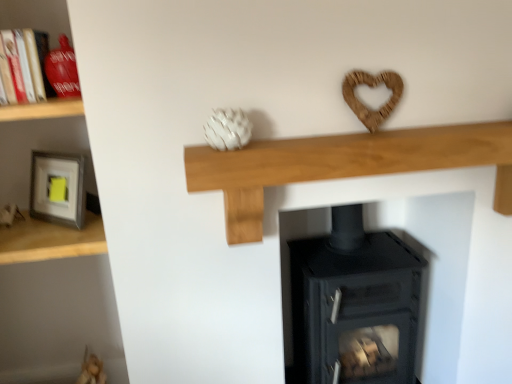
The height and width of the screenshot is (384, 512). What do you see at coordinates (27, 63) in the screenshot?
I see `matte red vase at upper left` at bounding box center [27, 63].

In order to face matte gray frame at left, arranged as the fourth shelf when viewed from the right, should I rotate leftwards or rightwards?

Rotate your view left by about 28.600°.

How much space does matte gray frame at left, arranged as the fourth shelf when viewed from the right, occupy horizontally?

46.19 centimeters.

The image size is (512, 384). Describe the element at coordinates (342, 165) in the screenshot. I see `natural wood mantle at center, which ranks as the first shelf in right-to-left order` at that location.

Find the location of a particular element. The width and height of the screenshot is (512, 384). wooden shelf at left, acting as the 3th shelf starting from the left is located at coordinates (42, 109).

Based on the photo, can you see matte gray frame at left, arranged as the third shelf when viewed from the right, touching wooden shelf at left, which appears as the 2th shelf when viewed from the right?

There is a gap between matte gray frame at left, arranged as the third shelf when viewed from the right, and wooden shelf at left, which appears as the 2th shelf when viewed from the right.

From the image's perspective, between matte gray frame at left, which ranks as the second shelf in left-to-right order, and wooden shelf at left, which appears as the 2th shelf when viewed from the right, which one is located above?

wooden shelf at left, which appears as the 2th shelf when viewed from the right, appears higher in the image.

Considering the sizes of objects matte gray frame at left, which ranks as the second shelf in left-to-right order, and wooden shelf at left, acting as the 3th shelf starting from the left, in the image provided, who is shorter, matte gray frame at left, which ranks as the second shelf in left-to-right order, or wooden shelf at left, acting as the 3th shelf starting from the left,?

wooden shelf at left, acting as the 3th shelf starting from the left, is shorter.

In the scene shown: Considering the sizes of matte gray frame at left, which ranks as the second shelf in left-to-right order, and wooden shelf at left, which appears as the 2th shelf when viewed from the right, in the image, is matte gray frame at left, which ranks as the second shelf in left-to-right order, wider or thinner than wooden shelf at left, which appears as the 2th shelf when viewed from the right,?

Considering their sizes, matte gray frame at left, which ranks as the second shelf in left-to-right order, looks slimmer than wooden shelf at left, which appears as the 2th shelf when viewed from the right.

Considering the relative sizes of matte red vase at upper left and natural wood mantle at center, placed as the 4th shelf when sorted from left to right, in the image provided, is matte red vase at upper left thinner than natural wood mantle at center, placed as the 4th shelf when sorted from left to right,?

No.

Is natural wood mantle at center, placed as the 4th shelf when sorted from left to right, surrounded by matte red vase at upper left?

Definitely not — natural wood mantle at center, placed as the 4th shelf when sorted from left to right, is not inside matte red vase at upper left.

From a real-world perspective, between matte red vase at upper left and natural wood mantle at center, placed as the 4th shelf when sorted from left to right, who is vertically lower?

From a 3D spatial view, natural wood mantle at center, placed as the 4th shelf when sorted from left to right, is below.

Who is taller, matte red vase at upper left or natural wood mantle at center, placed as the 4th shelf when sorted from left to right?

With more height is natural wood mantle at center, placed as the 4th shelf when sorted from left to right.

Is matte gray frame at left, arranged as the fourth shelf when viewed from the right, turned away from matte gray frame at left, which ranks as the second shelf in left-to-right order?

matte gray frame at left, arranged as the fourth shelf when viewed from the right, is not turned away from matte gray frame at left, which ranks as the second shelf in left-to-right order.

Is matte gray frame at left, which appears as the first shelf when viewed from the left, taller or shorter than matte gray frame at left, arranged as the third shelf when viewed from the right?

Clearly, matte gray frame at left, which appears as the first shelf when viewed from the left, is taller compared to matte gray frame at left, arranged as the third shelf when viewed from the right.

Between point (8, 230) and point (44, 246), which one is positioned behind?

Point (8, 230)

Which object is further away from the camera taking this photo, matte gray frame at left, which appears as the first shelf when viewed from the left, or matte gray frame at left, which ranks as the second shelf in left-to-right order?

matte gray frame at left, which ranks as the second shelf in left-to-right order.

From a real-world perspective, which object rests below the other?

From a 3D spatial view, black matte wood burning stove at center is below.

Based on the photo, from the image's perspective, is wooden shelf at left, acting as the 3th shelf starting from the left, over black matte wood burning stove at center?

Yes.

How different are the orientations of wooden shelf at left, which appears as the 2th shelf when viewed from the right, and black matte wood burning stove at center in degrees?

The angle between the facing direction of wooden shelf at left, which appears as the 2th shelf when viewed from the right, and the facing direction of black matte wood burning stove at center is 0.975 degrees.

Is point (53, 112) positioned behind point (318, 379)?

No.

Is natural wood mantle at center, which ranks as the first shelf in right-to-left order, next to matte red vase at upper left and touching it?

They are not placed beside each other.

Which object is further away from the camera taking this photo, natural wood mantle at center, placed as the 4th shelf when sorted from left to right, or matte red vase at upper left?

matte red vase at upper left is further away from the camera.

Locate an element on the screen. The width and height of the screenshot is (512, 384). shelf that is the 2nd object located in front of the matte red vase at upper left is located at coordinates (342, 165).

What's the angular difference between natural wood mantle at center, placed as the 4th shelf when sorted from left to right, and matte red vase at upper left's facing directions?

The angular difference between natural wood mantle at center, placed as the 4th shelf when sorted from left to right, and matte red vase at upper left is 6.83e-05 degrees.

Does black matte wood burning stove at center have a lesser height compared to wooden shelf at left, acting as the 3th shelf starting from the left?

Incorrect, the height of black matte wood burning stove at center does not fall short of that of wooden shelf at left, acting as the 3th shelf starting from the left.

Relative to wooden shelf at left, which appears as the 2th shelf when viewed from the right, is black matte wood burning stove at center in front or behind?

Clearly, black matte wood burning stove at center is behind wooden shelf at left, which appears as the 2th shelf when viewed from the right.

Is black matte wood burning stove at center far from wooden shelf at left, which appears as the 2th shelf when viewed from the right?

Absolutely, black matte wood burning stove at center is distant from wooden shelf at left, which appears as the 2th shelf when viewed from the right.

From the image's perspective, relative to wooden shelf at left, acting as the 3th shelf starting from the left, is black matte wood burning stove at center above or below?

From the image's perspective, black matte wood burning stove at center appears below wooden shelf at left, acting as the 3th shelf starting from the left.

Between natural wood mantle at center, placed as the 4th shelf when sorted from left to right, and matte gray frame at left, arranged as the fourth shelf when viewed from the right, which one has larger width?

matte gray frame at left, arranged as the fourth shelf when viewed from the right, is wider.

Does natural wood mantle at center, which ranks as the first shelf in right-to-left order, appear on the right side of matte gray frame at left, which appears as the first shelf when viewed from the left?

Indeed, natural wood mantle at center, which ranks as the first shelf in right-to-left order, is positioned on the right side of matte gray frame at left, which appears as the first shelf when viewed from the left.

Considering the sizes of objects natural wood mantle at center, placed as the 4th shelf when sorted from left to right, and matte gray frame at left, arranged as the fourth shelf when viewed from the right, in the image provided, who is bigger, natural wood mantle at center, placed as the 4th shelf when sorted from left to right, or matte gray frame at left, arranged as the fourth shelf when viewed from the right,?

Bigger between the two is matte gray frame at left, arranged as the fourth shelf when viewed from the right.

From the wooden shelf at left, acting as the 3th shelf starting from the left, count the 1st shelf to the left and point to it. Please provide its 2D coordinates.

[(50, 240)]

Image resolution: width=512 pixels, height=384 pixels. I want to click on the 2nd shelf in front of the matte red vase at upper left, so click(342, 165).

Looking at the image, which one is located further to black matte wood burning stove at center, matte gray frame at left, arranged as the fourth shelf when viewed from the right, or matte gray frame at left, arranged as the third shelf when viewed from the right?

matte gray frame at left, arranged as the fourth shelf when viewed from the right, is further to black matte wood burning stove at center.

When comparing their distances from wooden shelf at left, acting as the 3th shelf starting from the left, does matte gray frame at left, which ranks as the second shelf in left-to-right order, or black matte wood burning stove at center seem further?

black matte wood burning stove at center is further to wooden shelf at left, acting as the 3th shelf starting from the left.

Estimate the real-world distances between objects in this image. Which object is closer to matte gray frame at left, which appears as the first shelf when viewed from the left, natural wood mantle at center, placed as the 4th shelf when sorted from left to right, or matte gray frame at left, arranged as the third shelf when viewed from the right?

matte gray frame at left, arranged as the third shelf when viewed from the right, is positioned closer to the anchor matte gray frame at left, which appears as the first shelf when viewed from the left.

Which object lies nearer to the anchor point matte gray frame at left, which appears as the first shelf when viewed from the left, natural wood mantle at center, which ranks as the first shelf in right-to-left order, or wooden shelf at left, which appears as the 2th shelf when viewed from the right?

Based on the image, wooden shelf at left, which appears as the 2th shelf when viewed from the right, appears to be nearer to matte gray frame at left, which appears as the first shelf when viewed from the left.

When comparing their distances from natural wood mantle at center, which ranks as the first shelf in right-to-left order, does wooden shelf at left, which appears as the 2th shelf when viewed from the right, or matte red vase at upper left seem closer?

The object closer to natural wood mantle at center, which ranks as the first shelf in right-to-left order, is wooden shelf at left, which appears as the 2th shelf when viewed from the right.

Which object lies further to the anchor point matte gray frame at left, arranged as the third shelf when viewed from the right, matte red vase at upper left or black matte wood burning stove at center?

Among the two, black matte wood burning stove at center is located further to matte gray frame at left, arranged as the third shelf when viewed from the right.

From the image, which object appears to be nearer to black matte wood burning stove at center, wooden shelf at left, acting as the 3th shelf starting from the left, or matte gray frame at left, which ranks as the second shelf in left-to-right order?

The object closer to black matte wood burning stove at center is matte gray frame at left, which ranks as the second shelf in left-to-right order.

From the image, which object appears to be farther from matte gray frame at left, arranged as the fourth shelf when viewed from the right, matte gray frame at left, arranged as the third shelf when viewed from the right, or natural wood mantle at center, placed as the 4th shelf when sorted from left to right?

natural wood mantle at center, placed as the 4th shelf when sorted from left to right, lies further to matte gray frame at left, arranged as the fourth shelf when viewed from the right, than the other object.

Image resolution: width=512 pixels, height=384 pixels. Find the location of `book between matte gray frame at left, which appears as the first shelf when viewed from the left, and black matte wood burning stove at center from left to right`. book between matte gray frame at left, which appears as the first shelf when viewed from the left, and black matte wood burning stove at center from left to right is located at coordinates (27, 63).

Image resolution: width=512 pixels, height=384 pixels. In order to click on book between matte gray frame at left, which appears as the first shelf when viewed from the left, and natural wood mantle at center, which ranks as the first shelf in right-to-left order, in the horizontal direction in this screenshot , I will do `click(27, 63)`.

Identify the location of shelf situated between wooden shelf at left, acting as the 3th shelf starting from the left, and black matte wood burning stove at center from left to right. (342, 165).

You are a GUI agent. You are given a task and a screenshot of the screen. Output one action in this format:
    pyautogui.click(x=<x>, y=<y>)
    Task: Click on the shelf between matte gray frame at left, which ranks as the second shelf in left-to-right order, and natural wood mantle at center, placed as the 4th shelf when sorted from left to right
    This screenshot has height=384, width=512.
    Given the screenshot: What is the action you would take?
    pyautogui.click(x=42, y=109)